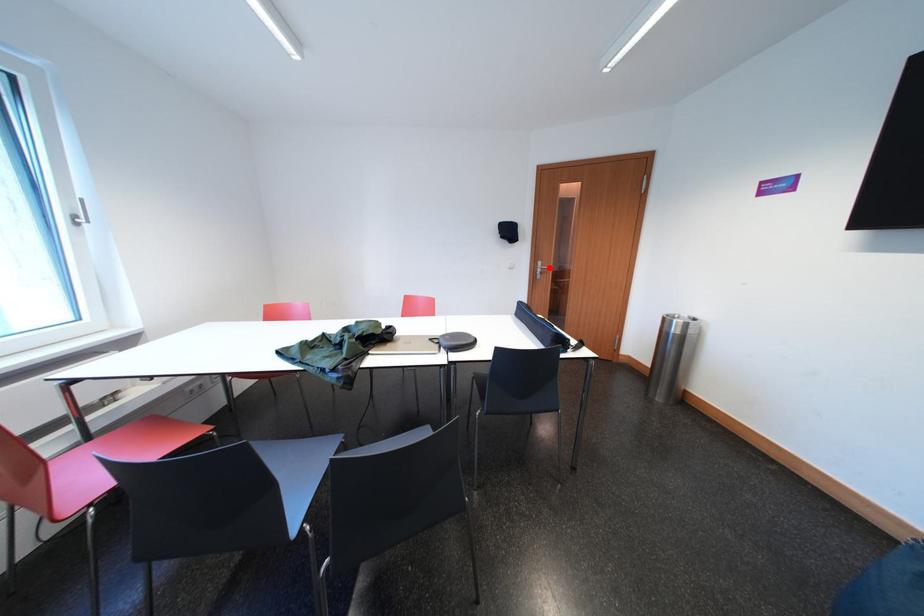
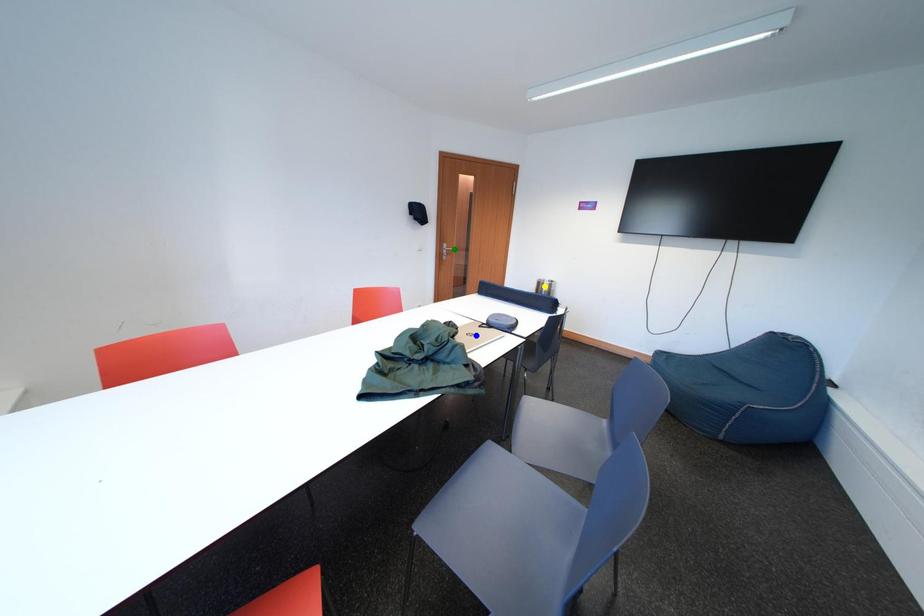
Question: I am providing you with two images of the same scene from different viewpoints. A red point is marked on the first image. You are given multiple points on the second image. Which point in image 2 represents the same 3d spot as the red point in image 1?

Choices:
 (A) green point
 (B) blue point
 (C) yellow point

Answer: (A)